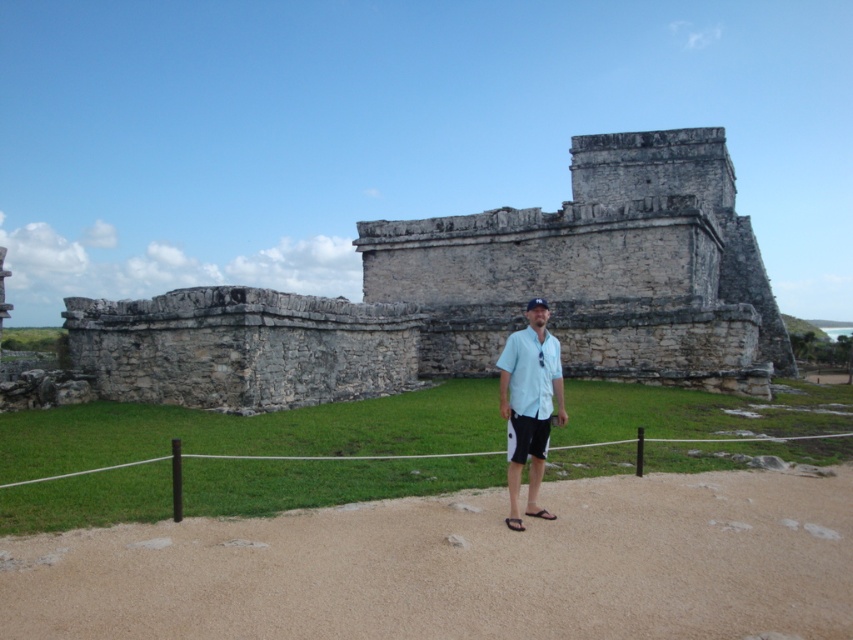
Question: Can you confirm if gray stone castle at center is wider than light blue fabric shirt at center?

Choices:
 (A) no
 (B) yes

Answer: (B)

Question: Which point is closer to the camera taking this photo?

Choices:
 (A) (535, 397)
 (B) (515, 392)

Answer: (A)

Question: Is the position of gray stone castle at center more distant than that of light blue fabric shirt at center?

Choices:
 (A) no
 (B) yes

Answer: (B)

Question: Which is farther from the light blue cotton polo shirt at center?

Choices:
 (A) light blue fabric shirt at center
 (B) gray stone castle at center

Answer: (B)

Question: Considering the real-world distances, which object is closest to the gray stone castle at center?

Choices:
 (A) light blue cotton polo shirt at center
 (B) light blue fabric shirt at center

Answer: (B)

Question: Is the position of gray stone castle at center less distant than that of light blue fabric shirt at center?

Choices:
 (A) no
 (B) yes

Answer: (A)